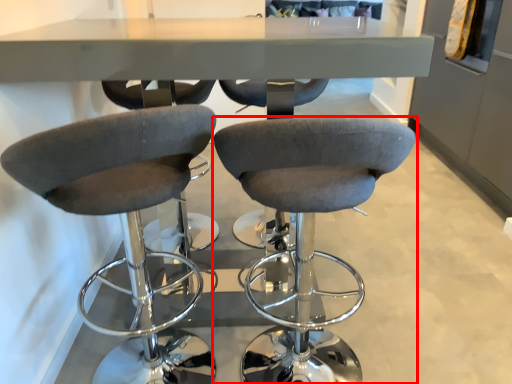
Question: Considering the relative positions of chair (annotated by the red box) and chair in the image provided, where is chair (annotated by the red box) located with respect to the staircase?

Choices:
 (A) right
 (B) left

Answer: (A)